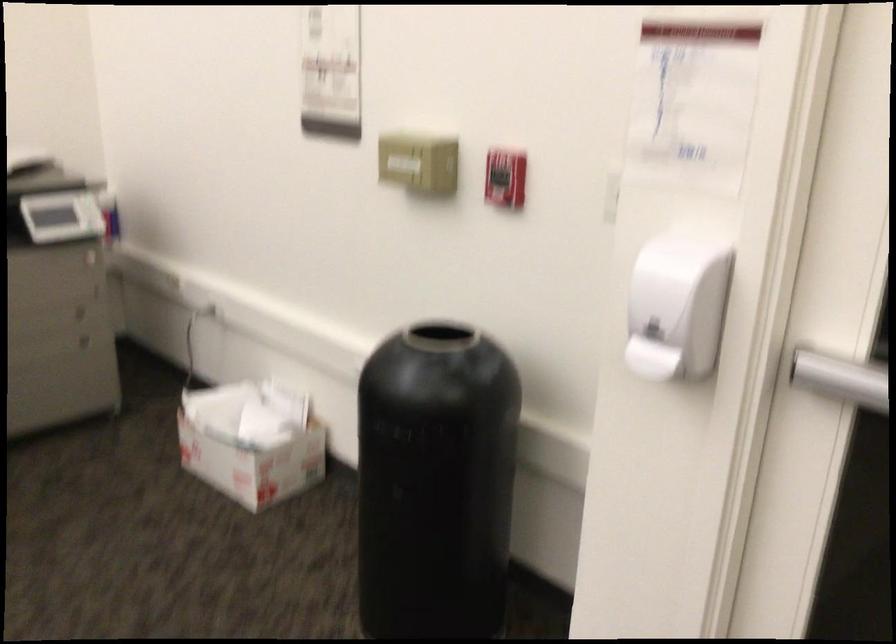
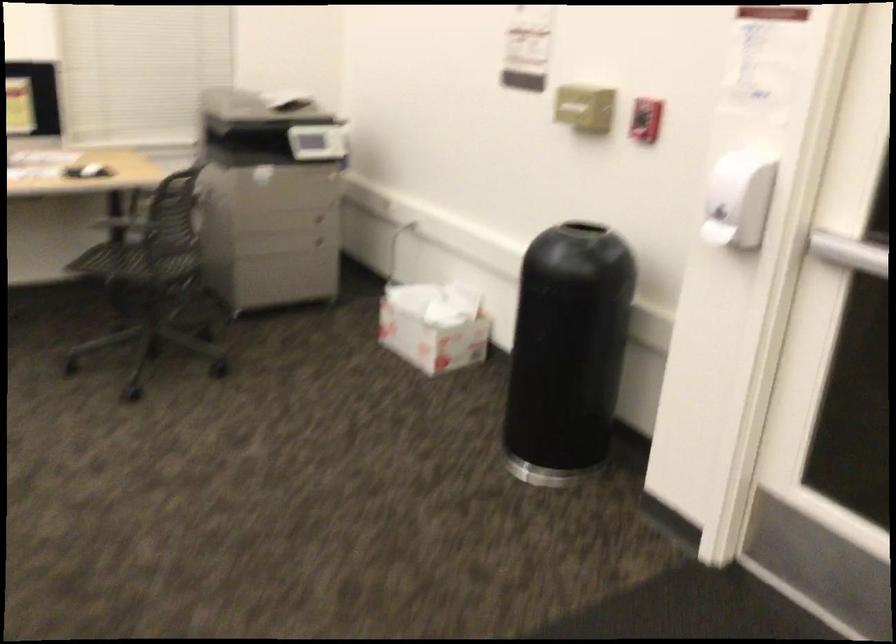
Question: In a continuous first-person perspective shot, in which direction is the camera moving?

Choices:
 (A) Left
 (B) Right
 (C) Forward
 (D) Backward

Answer: (D)